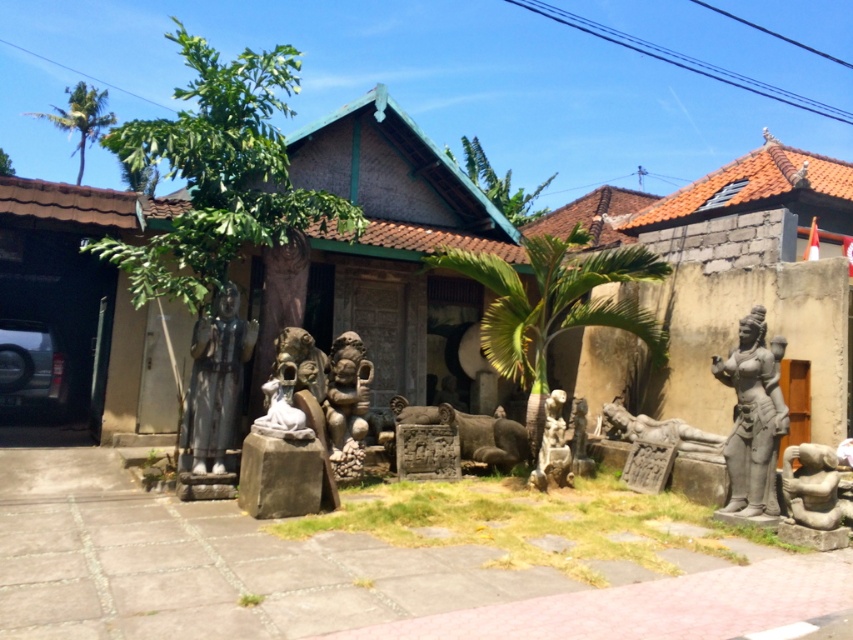
The height and width of the screenshot is (640, 853). In order to click on brown stone hut at upper right in this screenshot , I will do `click(750, 209)`.

Which is more to the right, brown stone hut at upper right or gray stone reclining figure at center?

brown stone hut at upper right is more to the right.

Is point (780, 202) behind point (618, 428)?

Yes, point (780, 202) is behind point (618, 428).

Where is `brown stone hut at upper right`? brown stone hut at upper right is located at coordinates (750, 209).

Locate an element on the screen. gray stone reclining figure at center is located at coordinates (660, 429).

In order to click on gray stone reclining figure at center in this screenshot , I will do `click(660, 429)`.

Locate an element on the screen. gray stone reclining figure at center is located at coordinates (660, 429).

Is the position of brown stone hut at upper right less distant than that of white stone statue at center?

That is False.

Does brown stone hut at upper right appear under white stone statue at center?

No.

Is point (809, 156) positioned in front of point (256, 419)?

No, it is not.

This screenshot has width=853, height=640. Identify the location of brown stone hut at upper right. (750, 209).